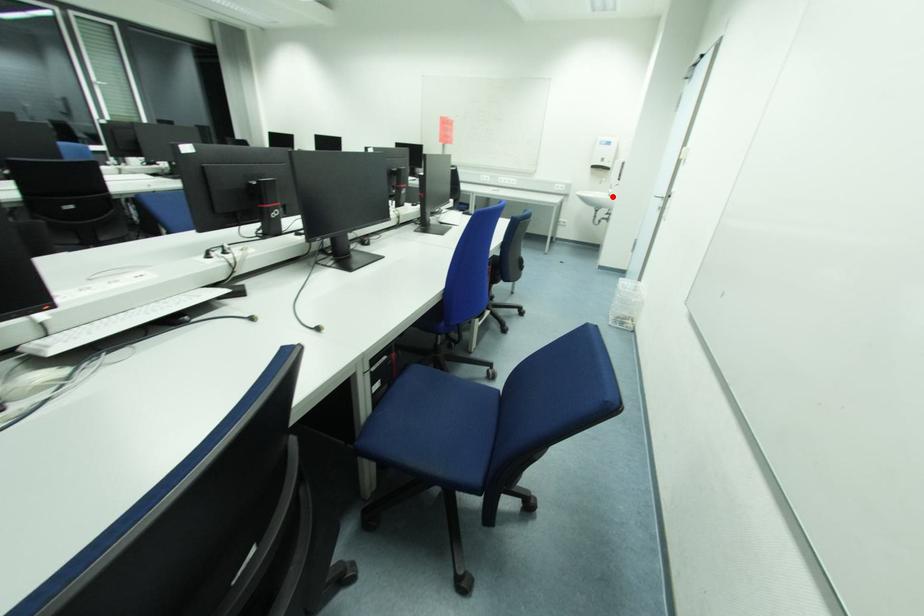
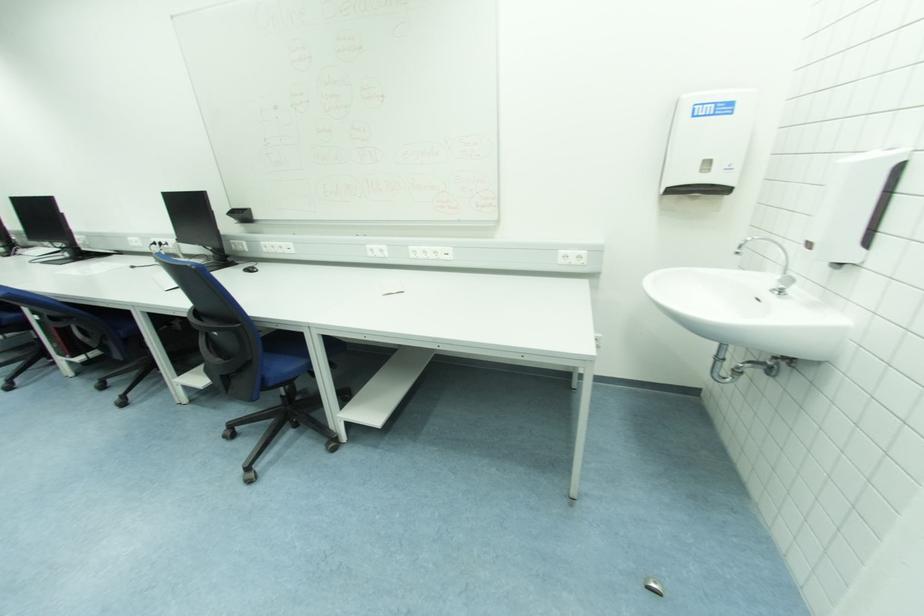
Question: I am providing you with two images of the same scene from different viewpoints. Image1 has a red point marked. In image2, the corresponding 3D location appears at what relative position? Reply with the corresponding letter.

Choices:
 (A) Closer
 (B) Farther

Answer: (B)